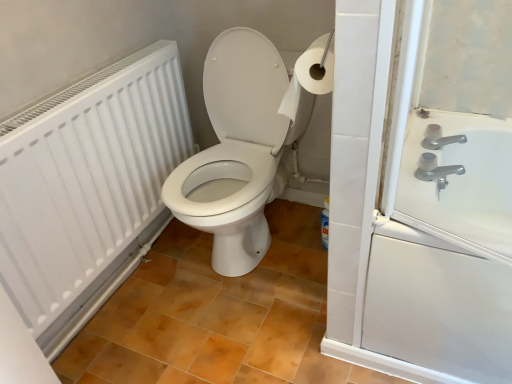
Question: From a real-world perspective, is satin nickel faucet at upper right positioned under white glossy toilet at center based on gravity?

Choices:
 (A) yes
 (B) no

Answer: (B)

Question: Does satin nickel faucet at upper right appear on the left side of white glossy toilet at center?

Choices:
 (A) no
 (B) yes

Answer: (A)

Question: Is white glossy toilet at center a part of satin nickel faucet at upper right?

Choices:
 (A) yes
 (B) no

Answer: (B)

Question: Is satin nickel faucet at upper right oriented away from white glossy toilet at center?

Choices:
 (A) no
 (B) yes

Answer: (B)

Question: Is satin nickel faucet at upper right at the right side of white glossy toilet at center?

Choices:
 (A) yes
 (B) no

Answer: (A)

Question: Is satin nickel faucet at upper right taller than white glossy toilet at center?

Choices:
 (A) no
 (B) yes

Answer: (A)

Question: Is white glossy toilet at center thinner than white matte radiator at left?

Choices:
 (A) yes
 (B) no

Answer: (B)

Question: Is white glossy toilet at center looking in the opposite direction of white matte radiator at left?

Choices:
 (A) no
 (B) yes

Answer: (A)

Question: Is white matte radiator at left inside white glossy toilet at center?

Choices:
 (A) yes
 (B) no

Answer: (B)

Question: Is white glossy toilet at center positioned beyond the bounds of white matte radiator at left?

Choices:
 (A) yes
 (B) no

Answer: (A)

Question: Is white glossy toilet at center behind white matte radiator at left?

Choices:
 (A) yes
 (B) no

Answer: (A)

Question: Would you say white glossy toilet at center is a long distance from white matte radiator at left?

Choices:
 (A) yes
 (B) no

Answer: (B)

Question: Does white matte radiator at left appear on the right side of white glossy toilet at center?

Choices:
 (A) no
 (B) yes

Answer: (A)